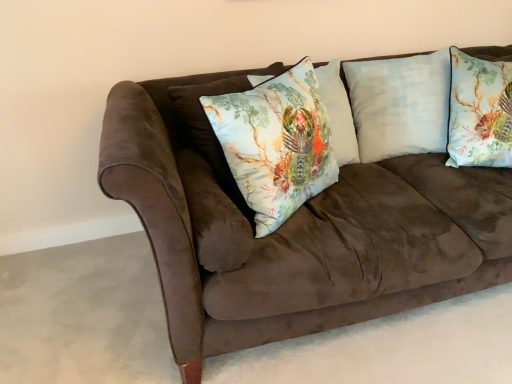
Question: Is printed fabric cushion at center, the 1th pillow from the left, positioned behind textured floral pillow at upper right, the first pillow viewed from the right?

Choices:
 (A) no
 (B) yes

Answer: (A)

Question: Is printed fabric cushion at center, the 1th pillow from the left, positioned in front of textured floral pillow at upper right, the fourth pillow when ordered from left to right?

Choices:
 (A) no
 (B) yes

Answer: (B)

Question: Is printed fabric cushion at center, which is the fourth pillow in right-to-left order, next to textured floral pillow at upper right, the fourth pillow when ordered from left to right?

Choices:
 (A) no
 (B) yes

Answer: (A)

Question: From a real-world perspective, is printed fabric cushion at center, the 1th pillow from the left, on textured floral pillow at upper right, the fourth pillow when ordered from left to right?

Choices:
 (A) no
 (B) yes

Answer: (B)

Question: Does printed fabric cushion at center, the 1th pillow from the left, have a lesser width compared to textured floral pillow at upper right, the first pillow viewed from the right?

Choices:
 (A) yes
 (B) no

Answer: (A)

Question: Considering their positions, is printed fabric pillow at center, the 3th pillow from the right, located in front of or behind printed fabric cushion at center, the 1th pillow from the left?

Choices:
 (A) behind
 (B) front

Answer: (A)

Question: From their relative heights in the image, would you say printed fabric pillow at center, arranged as the 2th pillow when viewed from the left, is taller or shorter than printed fabric cushion at center, the 1th pillow from the left?

Choices:
 (A) tall
 (B) short

Answer: (A)

Question: From the image's perspective, is printed fabric pillow at center, arranged as the 2th pillow when viewed from the left, positioned above or below printed fabric cushion at center, which is the fourth pillow in right-to-left order?

Choices:
 (A) above
 (B) below

Answer: (A)

Question: Is printed fabric pillow at center, the 3th pillow from the right, inside or outside of printed fabric cushion at center, the 1th pillow from the left?

Choices:
 (A) inside
 (B) outside

Answer: (B)

Question: Would you say light blue cotton pillow at upper right, the second pillow viewed from the right, is inside or outside textured floral pillow at upper right, the fourth pillow when ordered from left to right?

Choices:
 (A) outside
 (B) inside

Answer: (A)

Question: Is light blue cotton pillow at upper right, the third pillow from the left, to the left or to the right of textured floral pillow at upper right, the first pillow viewed from the right, in the image?

Choices:
 (A) right
 (B) left

Answer: (B)

Question: From a real-world perspective, is light blue cotton pillow at upper right, the third pillow from the left, positioned above or below textured floral pillow at upper right, the fourth pillow when ordered from left to right?

Choices:
 (A) below
 (B) above

Answer: (A)

Question: Is light blue cotton pillow at upper right, the third pillow from the left, in front of or behind textured floral pillow at upper right, the first pillow viewed from the right, in the image?

Choices:
 (A) front
 (B) behind

Answer: (B)

Question: From the image's perspective, is printed fabric pillow at center, the 3th pillow from the right, located above or below textured floral pillow at upper right, the first pillow viewed from the right?

Choices:
 (A) below
 (B) above

Answer: (A)

Question: Relative to textured floral pillow at upper right, the first pillow viewed from the right, is printed fabric pillow at center, arranged as the 2th pillow when viewed from the left, in front or behind?

Choices:
 (A) front
 (B) behind

Answer: (A)